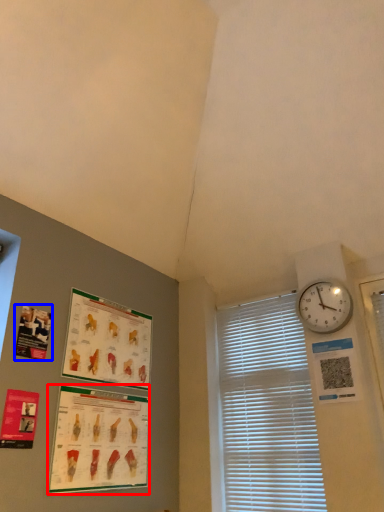
Question: Which of the following is the closest to the observer, poster page (highlighted by a red box) or poster page (highlighted by a blue box)?

Choices:
 (A) poster page
 (B) poster page

Answer: (A)